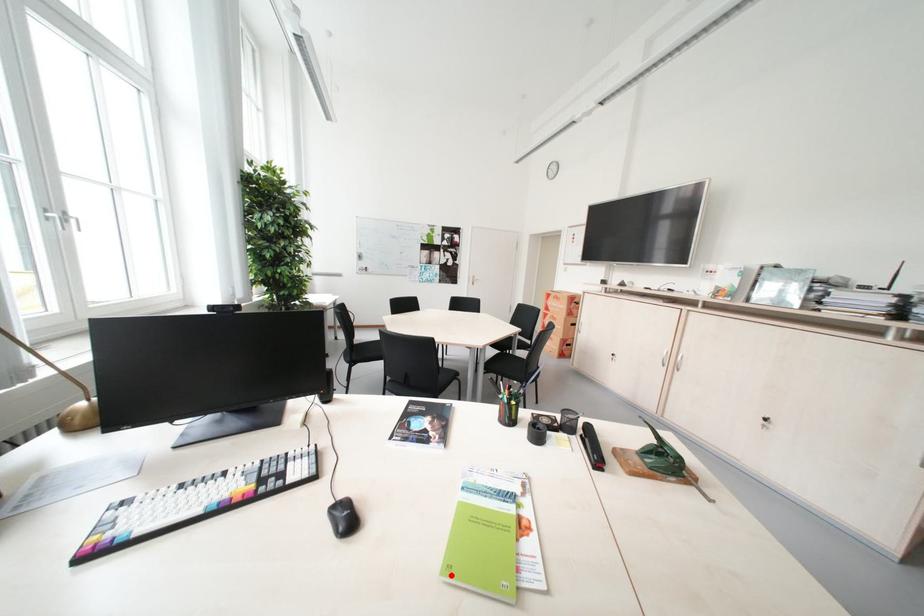
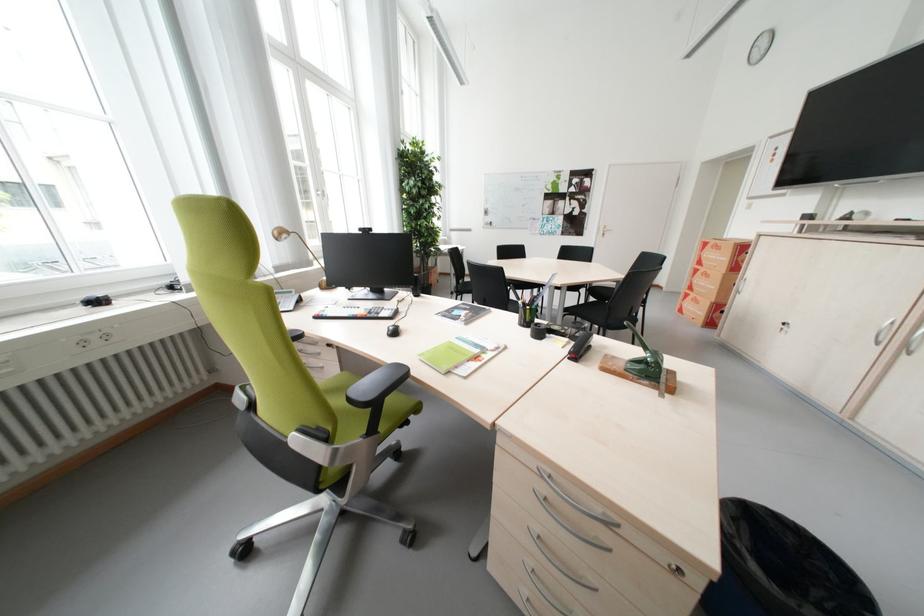
Find the pixel in the second image that matches the highlighted location in the first image.

(429, 357)